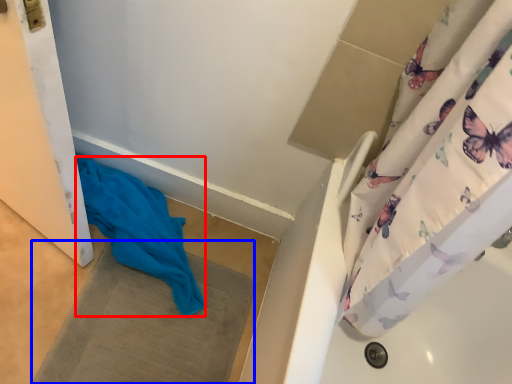
Question: Among these objects, which one is farthest to the camera, fabric (highlighted by a red box) or bath mat (highlighted by a blue box)?

Choices:
 (A) fabric
 (B) bath mat

Answer: (A)